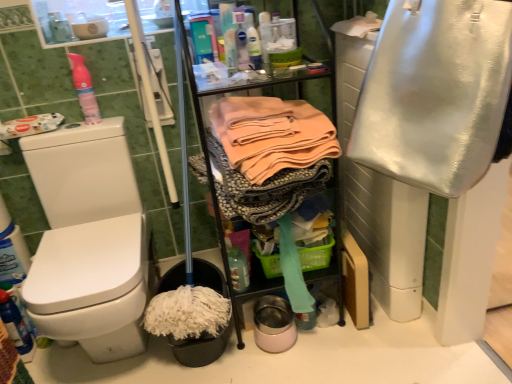
What is the approximate width of soft peach fabric at center, which ranks as the second clothing in right-to-left order?

soft peach fabric at center, which ranks as the second clothing in right-to-left order, is 17.51 inches in width.

What is the approximate height of green plastic basket at center?

The height of green plastic basket at center is 4.36 inches.

Measure the distance between green plastic basket at center and camera.

The distance of green plastic basket at center from camera is 4.71 feet.

The width and height of the screenshot is (512, 384). Describe the element at coordinates (238, 270) in the screenshot. I see `translucent plastic bottle at center` at that location.

You are a GUI agent. You are given a task and a screenshot of the screen. Output one action in this format:
    pyautogui.click(x=<x>, y=<y>)
    Task: Click on the translucent plastic bottle at center
    
    Given the screenshot: What is the action you would take?
    pyautogui.click(x=238, y=270)

This screenshot has height=384, width=512. Identify the location of shiny metallic bag at right, which is the 1th clothing from right to left. pyautogui.click(x=435, y=93).

Which of these two, green plastic basket at center or translucent plastic bottle at center, is bigger?

With larger size is green plastic basket at center.

Is green plastic basket at center taller or shorter than translucent plastic bottle at center?

In the image, green plastic basket at center appears to be shorter than translucent plastic bottle at center.

Which is more distant, (322, 254) or (239, 252)?

Point (322, 254)

How different are the orientations of shiny metallic bag at right, which is the 1th clothing from right to left, and pink matte spray can at upper left in degrees?

The angular difference between shiny metallic bag at right, which is the 1th clothing from right to left, and pink matte spray can at upper left is 57.8 degrees.

Does point (423, 145) appear closer or farther from the camera than point (89, 96)?

Clearly, point (423, 145) is closer to the camera than point (89, 96).

Is shiny metallic bag at right, acting as the 2th clothing starting from the left, thinner than pink matte spray can at upper left?

In fact, shiny metallic bag at right, acting as the 2th clothing starting from the left, might be wider than pink matte spray can at upper left.

Considering the sizes of objects shiny metallic bag at right, which is the 1th clothing from right to left, and soft peach fabric at center, the first clothing viewed from the left, in the image provided, who is bigger, shiny metallic bag at right, which is the 1th clothing from right to left, or soft peach fabric at center, the first clothing viewed from the left,?

Bigger between the two is soft peach fabric at center, the first clothing viewed from the left.

Where is `clothing behind the shiny metallic bag at right, which is the 1th clothing from right to left`? The height and width of the screenshot is (384, 512). clothing behind the shiny metallic bag at right, which is the 1th clothing from right to left is located at coordinates (268, 155).

From a real-world perspective, which is physically above, shiny metallic bag at right, which is the 1th clothing from right to left, or soft peach fabric at center, which ranks as the second clothing in right-to-left order?

In real-world perspective, shiny metallic bag at right, which is the 1th clothing from right to left, is above.

From the image's perspective, is green plastic basket at center beneath pink matte spray can at upper left?

Indeed, from the image's perspective, green plastic basket at center is shown beneath pink matte spray can at upper left.

From a real-world perspective, does green plastic basket at center stand above pink matte spray can at upper left?

No, from a real-world perspective, green plastic basket at center is not over pink matte spray can at upper left

Are green plastic basket at center and pink matte spray can at upper left making contact?

green plastic basket at center and pink matte spray can at upper left are not in contact.

Is green plastic basket at center facing towards pink matte spray can at upper left?

No, green plastic basket at center is not aimed at pink matte spray can at upper left.

Is pink matte spray can at upper left beside translucent plastic bottle at center?

No.

Between pink matte spray can at upper left and translucent plastic bottle at center, which one has larger size?

Bigger between the two is pink matte spray can at upper left.

From the image's perspective, between pink matte spray can at upper left and translucent plastic bottle at center, which one is located above?

pink matte spray can at upper left is shown above in the image.

Is pink matte spray can at upper left situated inside translucent plastic bottle at center or outside?

pink matte spray can at upper left is located beyond the bounds of translucent plastic bottle at center.

Is soft peach fabric at center, which ranks as the second clothing in right-to-left order, at the back of translucent plastic bottle at center?

That's not correct — translucent plastic bottle at center is not looking away from soft peach fabric at center, which ranks as the second clothing in right-to-left order.

Would you consider translucent plastic bottle at center to be distant from soft peach fabric at center, the first clothing viewed from the left?

translucent plastic bottle at center is actually quite close to soft peach fabric at center, the first clothing viewed from the left.

Based on their positions, is translucent plastic bottle at center located to the left or right of soft peach fabric at center, the first clothing viewed from the left?

From the image, it's evident that translucent plastic bottle at center is to the left of soft peach fabric at center, the first clothing viewed from the left.

Can you confirm if translucent plastic bottle at center is thinner than soft peach fabric at center, which ranks as the second clothing in right-to-left order?

Correct, the width of translucent plastic bottle at center is less than that of soft peach fabric at center, which ranks as the second clothing in right-to-left order.

In terms of width, does pink matte spray can at upper left look wider or thinner when compared to shiny metallic bag at right, acting as the 2th clothing starting from the left?

Considering their sizes, pink matte spray can at upper left looks slimmer than shiny metallic bag at right, acting as the 2th clothing starting from the left.

Considering the relative positions of pink matte spray can at upper left and shiny metallic bag at right, acting as the 2th clothing starting from the left, in the image provided, is pink matte spray can at upper left to the left or to the right of shiny metallic bag at right, acting as the 2th clothing starting from the left,?

In the image, pink matte spray can at upper left appears on the left side of shiny metallic bag at right, acting as the 2th clothing starting from the left.

Is pink matte spray can at upper left completely or partially outside of shiny metallic bag at right, which is the 1th clothing from right to left?

That's correct, pink matte spray can at upper left is outside of shiny metallic bag at right, which is the 1th clothing from right to left.

From the image's perspective, is pink matte spray can at upper left above or below shiny metallic bag at right, which is the 1th clothing from right to left?

pink matte spray can at upper left is above shiny metallic bag at right, which is the 1th clothing from right to left.

The image size is (512, 384). In order to click on basket behind the translucent plastic bottle at center in this screenshot , I will do `click(316, 255)`.

Identify the location of clothing that is the 2nd object located in front of the pink matte spray can at upper left. (435, 93).

Looking at the image, which one is located further to pink matte spray can at upper left, translucent plastic bottle at center or green plastic basket at center?

green plastic basket at center.

Considering their positions, is green plastic basket at center positioned closer to shiny metallic bag at right, acting as the 2th clothing starting from the left, than translucent plastic bottle at center?

green plastic basket at center is closer to shiny metallic bag at right, acting as the 2th clothing starting from the left.

Based on their spatial positions, is translucent plastic bottle at center or pink matte spray can at upper left further from green plastic basket at center?

The object further to green plastic basket at center is pink matte spray can at upper left.

Based on their spatial positions, is shiny metallic bag at right, acting as the 2th clothing starting from the left, or translucent plastic bottle at center closer to soft peach fabric at center, which ranks as the second clothing in right-to-left order?

shiny metallic bag at right, acting as the 2th clothing starting from the left.

Considering their positions, is soft peach fabric at center, the first clothing viewed from the left, positioned further to pink matte spray can at upper left than shiny metallic bag at right, acting as the 2th clothing starting from the left?

Among the two, shiny metallic bag at right, acting as the 2th clothing starting from the left, is located further to pink matte spray can at upper left.

Estimate the real-world distances between objects in this image. Which object is further from soft peach fabric at center, the first clothing viewed from the left, shiny metallic bag at right, acting as the 2th clothing starting from the left, or pink matte spray can at upper left?

Based on the image, pink matte spray can at upper left appears to be further to soft peach fabric at center, the first clothing viewed from the left.

When comparing their distances from green plastic basket at center, does pink matte spray can at upper left or translucent plastic bottle at center seem further?

Based on the image, pink matte spray can at upper left appears to be further to green plastic basket at center.

When comparing their distances from translucent plastic bottle at center, does soft peach fabric at center, the first clothing viewed from the left, or shiny metallic bag at right, acting as the 2th clothing starting from the left, seem further?

The object further to translucent plastic bottle at center is shiny metallic bag at right, acting as the 2th clothing starting from the left.

Locate an element on the screen. clothing between shiny metallic bag at right, which is the 1th clothing from right to left, and green plastic basket at center from front to back is located at coordinates tap(268, 155).

Find the location of a particular element. The image size is (512, 384). bottle positioned between shiny metallic bag at right, which is the 1th clothing from right to left, and green plastic basket at center from near to far is located at coordinates (238, 270).

Find the location of a particular element. The image size is (512, 384). bottle between pink matte spray can at upper left and green plastic basket at center from left to right is located at coordinates (238, 270).

This screenshot has width=512, height=384. Identify the location of basket that lies between soft peach fabric at center, which ranks as the second clothing in right-to-left order, and translucent plastic bottle at center from top to bottom. (316, 255).